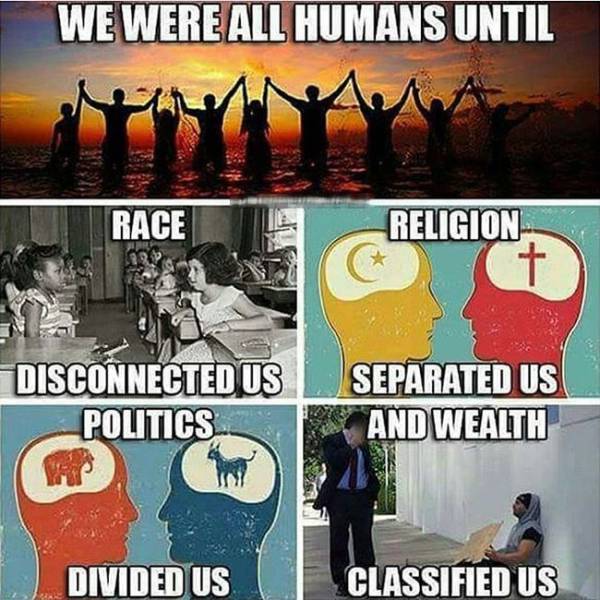
The width and height of the screenshot is (600, 600). Find the location of `pictures`. pictures is located at coordinates (441, 509), (147, 496), (129, 300), (456, 284), (316, 68).